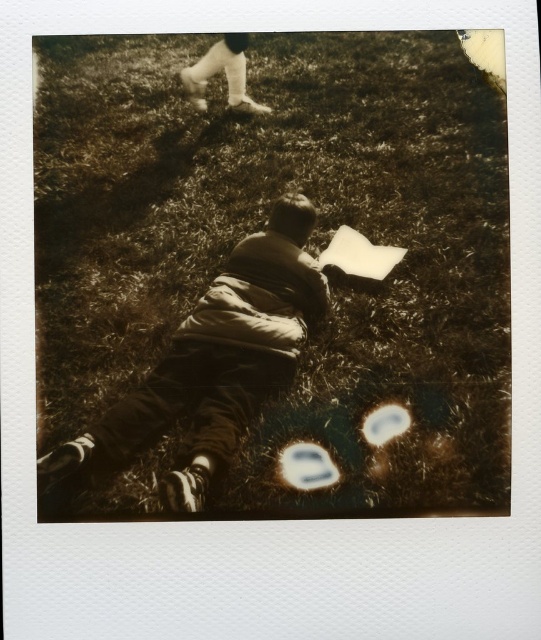
You are a photographer analyzing the composition of this vintage Polaroid image. The scene includes a child lying on the grass and a brown cotton shirt at center. Based on the shirt location, where would you estimate the shirt is placed in the image frame?

The brown cotton shirt at center is located at the coordinates point (209, 368) in the image frame.